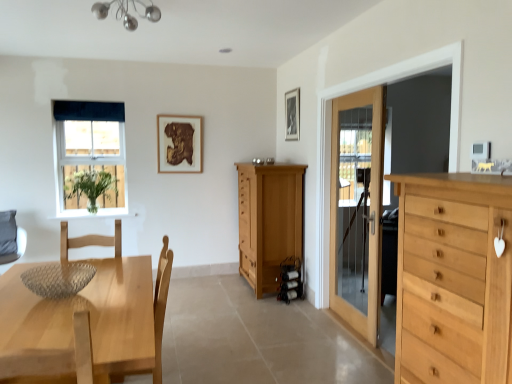
Question: Are light brown wooden table at lower left and light wood chest of drawers at right, the second chest of drawers when ordered from left to right, far apart?

Choices:
 (A) yes
 (B) no

Answer: (A)

Question: Considering the relative sizes of light brown wooden table at lower left and light wood chest of drawers at right, placed as the 2th chest of drawers when sorted from back to front, in the image provided, is light brown wooden table at lower left thinner than light wood chest of drawers at right, placed as the 2th chest of drawers when sorted from back to front,?

Choices:
 (A) yes
 (B) no

Answer: (B)

Question: From a real-world perspective, does light brown wooden table at lower left stand above light wood chest of drawers at right, acting as the 1th chest of drawers starting from the right?

Choices:
 (A) yes
 (B) no

Answer: (B)

Question: Is light brown wooden table at lower left behind light wood chest of drawers at right, placed as the 2th chest of drawers when sorted from back to front?

Choices:
 (A) no
 (B) yes

Answer: (B)

Question: From the image's perspective, is light brown wooden table at lower left under light wood chest of drawers at right, placed as the 2th chest of drawers when sorted from back to front?

Choices:
 (A) yes
 (B) no

Answer: (A)

Question: Is light brown wooden table at lower left taller than light wood chest of drawers at right, acting as the 1th chest of drawers starting from the right?

Choices:
 (A) yes
 (B) no

Answer: (B)

Question: Is light brown wooden table at lower left directly adjacent to dark blue fabric at upper left?

Choices:
 (A) no
 (B) yes

Answer: (A)

Question: Is light brown wooden table at lower left completely or partially outside of dark blue fabric at upper left?

Choices:
 (A) no
 (B) yes

Answer: (B)

Question: Is dark blue fabric at upper left inside light brown wooden table at lower left?

Choices:
 (A) no
 (B) yes

Answer: (A)

Question: Is light brown wooden table at lower left at the right side of dark blue fabric at upper left?

Choices:
 (A) no
 (B) yes

Answer: (B)

Question: Is light brown wooden table at lower left positioned far away from dark blue fabric at upper left?

Choices:
 (A) no
 (B) yes

Answer: (B)

Question: From a real-world perspective, is light brown wooden table at lower left positioned under dark blue fabric at upper left based on gravity?

Choices:
 (A) no
 (B) yes

Answer: (B)

Question: Is light wood chest of drawers at right, which ranks as the 1th chest of drawers in front-to-back order, outside green matte vase at left?

Choices:
 (A) no
 (B) yes

Answer: (B)